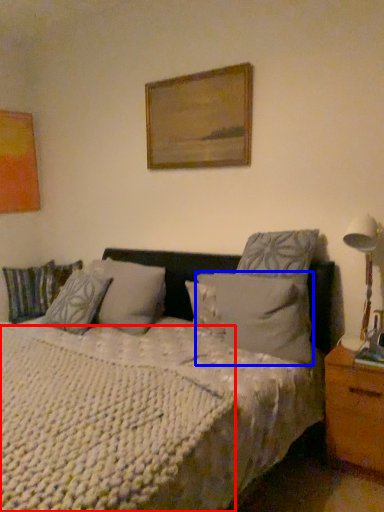
Question: Which object appears farthest to the camera in this image, mattress (highlighted by a red box) or pillow (highlighted by a blue box)?

Choices:
 (A) mattress
 (B) pillow

Answer: (B)